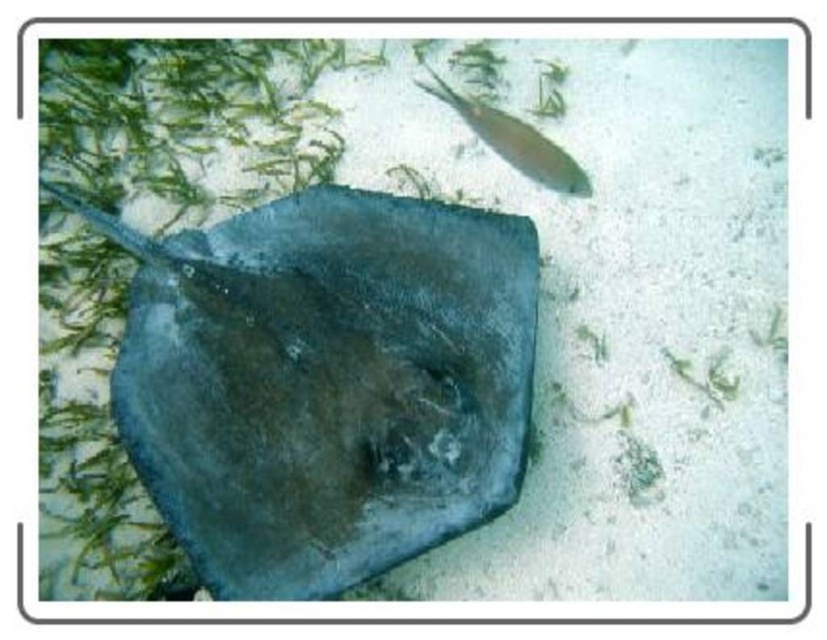
You are a marine biologist observing an underwater scene. You notice a dark blue leather stingray at center and a shiny silver fish at upper right. Which of these two marine creatures has a greater height in the image?

The dark blue leather stingray at center is taller than the shiny silver fish at upper right according to the description provided.

You are a marine biologist observing an underwater scene. You notice a dark blue leather stingray at center and a shiny silver fish at upper right. Which object is wider?

The dark blue leather stingray at center might be wider than the shiny silver fish at upper right according to the description.

You are a marine biologist studying underwater creatures. You observe the dark blue leather stingray at center in the image. What are the coordinates of its position?

The coordinates of the dark blue leather stingray at center are at point (326, 381).